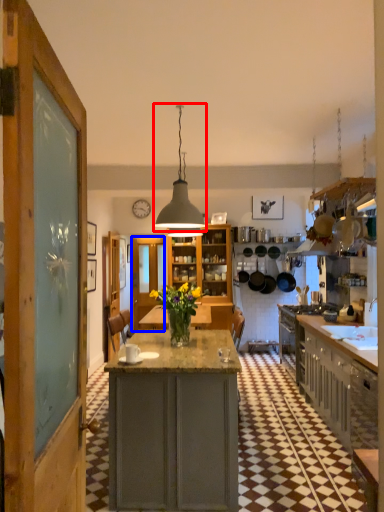
Question: Which point is further to the camera, light fixture (highlighted by a red box) or glass door (highlighted by a blue box)?

Choices:
 (A) light fixture
 (B) glass door

Answer: (B)